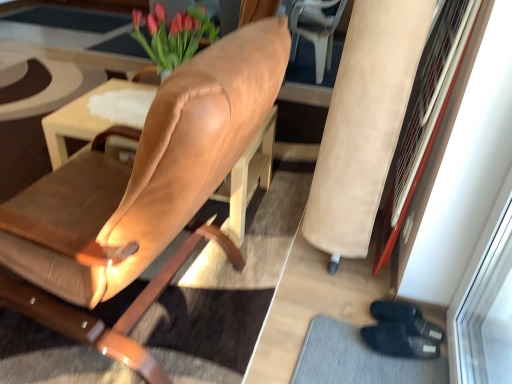
Question: Is the position of suede-like beige armchair at right less distant than that of leather armchair at upper right?

Choices:
 (A) no
 (B) yes

Answer: (B)

Question: Does suede-like beige armchair at right come behind leather armchair at upper right?

Choices:
 (A) no
 (B) yes

Answer: (A)

Question: Is suede-like beige armchair at right located outside leather armchair at upper right?

Choices:
 (A) yes
 (B) no

Answer: (A)

Question: From the image's perspective, does suede-like beige armchair at right appear lower than leather armchair at upper right?

Choices:
 (A) no
 (B) yes

Answer: (B)

Question: Can you confirm if suede-like beige armchair at right is shorter than leather armchair at upper right?

Choices:
 (A) no
 (B) yes

Answer: (A)

Question: In terms of size, does leather armchair at upper right appear bigger or smaller than black fabric doormat at lower right?

Choices:
 (A) small
 (B) big

Answer: (B)

Question: Is leather armchair at upper right wider or thinner than black fabric doormat at lower right?

Choices:
 (A) wide
 (B) thin

Answer: (A)

Question: From a real-world perspective, is leather armchair at upper right physically located above or below black fabric doormat at lower right?

Choices:
 (A) above
 (B) below

Answer: (A)

Question: Is leather armchair at upper right taller or shorter than black fabric doormat at lower right?

Choices:
 (A) short
 (B) tall

Answer: (B)

Question: Is leather chair at center wider or thinner than matte brown table at center?

Choices:
 (A) thin
 (B) wide

Answer: (A)

Question: Considering the relative positions of leather chair at center and matte brown table at center in the image provided, is leather chair at center to the left or to the right of matte brown table at center?

Choices:
 (A) left
 (B) right

Answer: (A)

Question: Relative to matte brown table at center, is leather chair at center in front or behind?

Choices:
 (A) behind
 (B) front

Answer: (B)

Question: Based on their sizes in the image, would you say leather chair at center is bigger or smaller than matte brown table at center?

Choices:
 (A) small
 (B) big

Answer: (B)

Question: From the image's perspective, relative to suede-like beige armchair at right, is black fabric doormat at lower right above or below?

Choices:
 (A) above
 (B) below

Answer: (B)

Question: From a real-world perspective, is black fabric doormat at lower right physically located above or below suede-like beige armchair at right?

Choices:
 (A) above
 (B) below

Answer: (B)